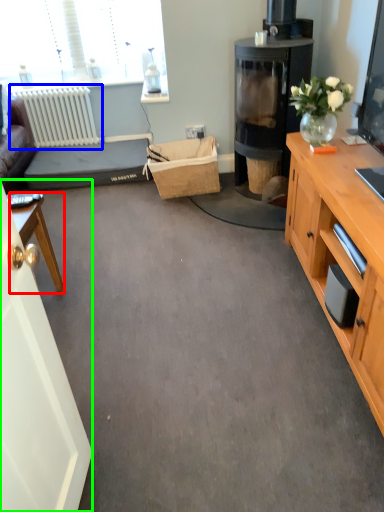
Question: Estimate the real-world distances between objects in this image. Which object is closer to desk (highlighted by a red box), radiator (highlighted by a blue box) or glass door (highlighted by a green box)?

Choices:
 (A) radiator
 (B) glass door

Answer: (B)